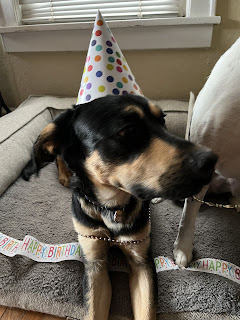
The image size is (240, 320). I want to click on wall, so click(164, 79).